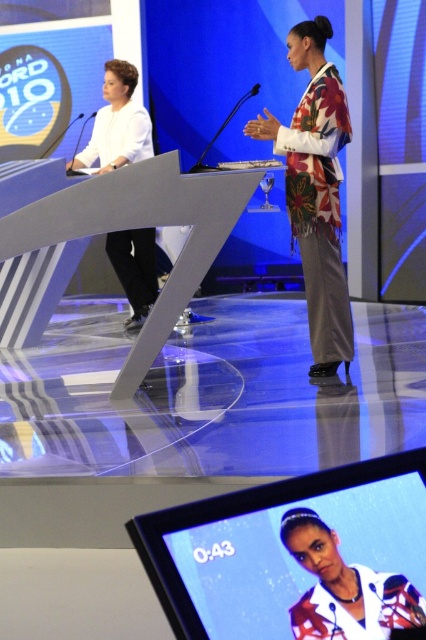
Question: Which point is closer to the camera?

Choices:
 (A) (137, 310)
 (B) (181, 218)
 (C) (414, 604)
 (D) (276, 529)

Answer: (D)

Question: Which is farther from the white matte shirt at left?

Choices:
 (A) floral-patterned fabric at center
 (B) metallic gray podium at center
 (C) floral fabric dress at center
 (D) matte digital display at center

Answer: (C)

Question: Does matte digital display at center have a greater width compared to metallic gray podium at center?

Choices:
 (A) yes
 (B) no

Answer: (B)

Question: Can you confirm if metallic gray podium at center is wider than floral-patterned fabric at center?

Choices:
 (A) no
 (B) yes

Answer: (B)

Question: Can you confirm if matte digital display at center is positioned above metallic gray podium at center?

Choices:
 (A) yes
 (B) no

Answer: (B)

Question: Estimate the real-world distances between objects in this image. Which object is farther from the floral-patterned fabric at center?

Choices:
 (A) white matte shirt at left
 (B) floral fabric dress at center
 (C) matte digital display at center
 (D) metallic gray podium at center

Answer: (B)